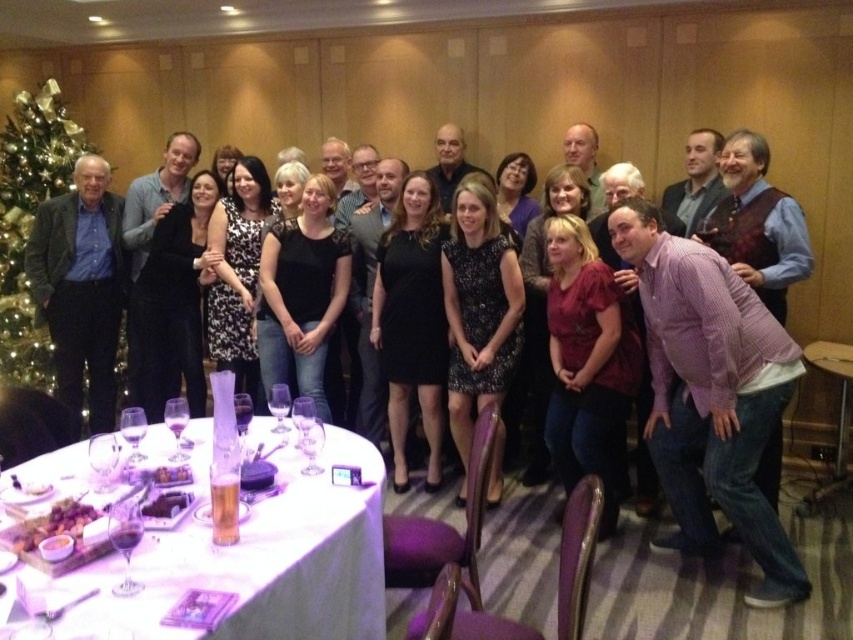
You are a guest at a Christmas party and want to find the green glittering Christmas tree at left. The party is in a large banquet hall with wooden paneling and a carpeted floor. You are currently standing at the point with coordinates point [30,224]. Can you see the green glittering Christmas tree at left from your current position?

Yes, the point [30,224] indicates the green glittering Christmas tree at left, so you are already at the location of the tree and can see it.